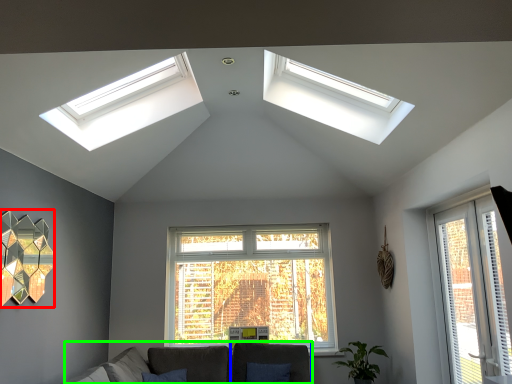
Question: Which is nearer to the lamp (highlighted by a red box)? armchair (highlighted by a blue box) or couch (highlighted by a green box).

Choices:
 (A) armchair
 (B) couch

Answer: (B)